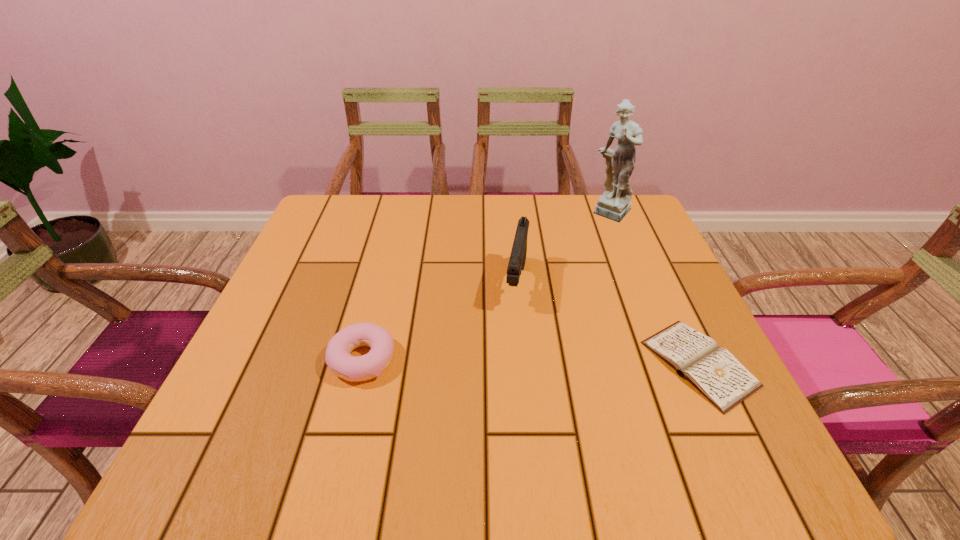
At what (x,y) coordinates should I click in order to perform the action: click on blank space located at the barrel of the second object from left to right. Please return your answer as a coordinate pair (x, y). Looking at the image, I should click on (496, 415).

The width and height of the screenshot is (960, 540). Find the location of `vacant position located at the barrel of the second object from left to right`. vacant position located at the barrel of the second object from left to right is located at coordinates (508, 356).

Find the location of `vacant space located 0.070m on the front-facing side of the tallest object`. vacant space located 0.070m on the front-facing side of the tallest object is located at coordinates 596,238.

The height and width of the screenshot is (540, 960). I want to click on free space located 0.380m on the front-facing side of the tallest object, so click(543, 309).

You are a GUI agent. You are given a task and a screenshot of the screen. Output one action in this format:
    pyautogui.click(x=<x>, y=<y>)
    Task: Click on the free space located on the front-facing side of the tallest object
    The width and height of the screenshot is (960, 540).
    Given the screenshot: What is the action you would take?
    pyautogui.click(x=545, y=307)

I want to click on object that is at the far edge, so click(x=614, y=204).

This screenshot has height=540, width=960. In order to click on doughnut at the near edge in this screenshot , I will do `click(338, 358)`.

Identify the location of diary present at the near edge. (714, 371).

The width and height of the screenshot is (960, 540). Identify the location of diary located in the right edge section of the desktop. (714, 371).

You are a GUI agent. You are given a task and a screenshot of the screen. Output one action in this format:
    pyautogui.click(x=<x>, y=<y>)
    Task: Click on the figurine that is at the right edge
    The width and height of the screenshot is (960, 540).
    Given the screenshot: What is the action you would take?
    pyautogui.click(x=614, y=204)